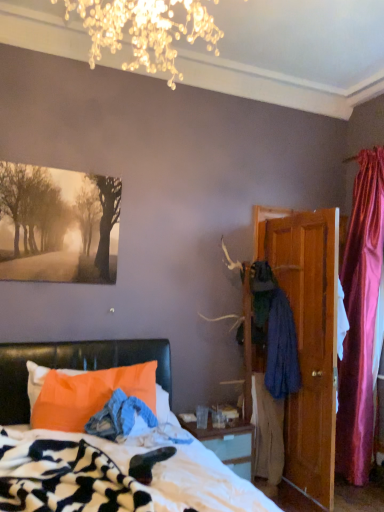
Question: From their relative heights in the image, would you say orange fabric pillow at lower left is taller or shorter than wooden door at right?

Choices:
 (A) short
 (B) tall

Answer: (A)

Question: From a real-world perspective, is orange fabric pillow at lower left positioned above or below wooden door at right?

Choices:
 (A) above
 (B) below

Answer: (B)

Question: Which of these objects is positioned farthest from the orange fabric bed at lower left?

Choices:
 (A) orange fabric pillow at lower left
 (B) matte black painting at upper left
 (C) wooden door at right
 (D) dark blue fabric coat at right

Answer: (C)

Question: Which of these objects is positioned closest to the wooden door at right?

Choices:
 (A) matte black painting at upper left
 (B) dark blue fabric coat at right
 (C) orange fabric pillow at lower left
 (D) orange fabric bed at lower left

Answer: (B)